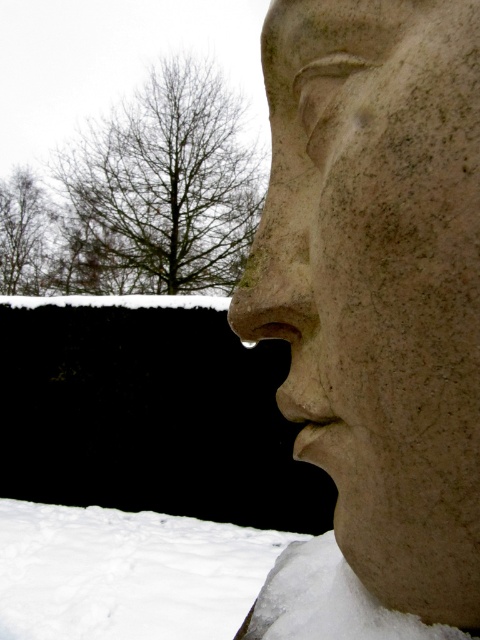
Question: Where is white fluffy snow at lower left located in relation to rough stone nose at center in the image?

Choices:
 (A) above
 (B) below

Answer: (B)

Question: Can you confirm if white fluffy snow at lower left is smaller than brown leafless tree at upper left?

Choices:
 (A) no
 (B) yes

Answer: (B)

Question: Which of the following is the farthest from the observer?

Choices:
 (A) brown leafless tree at upper left
 (B) granite statue at center
 (C) white fluffy snow at lower left
 (D) rough stone nose at center

Answer: (A)

Question: Is the position of granite statue at center more distant than that of rough stone nose at center?

Choices:
 (A) no
 (B) yes

Answer: (A)

Question: Estimate the real-world distances between objects in this image. Which object is closer to the granite statue at center?

Choices:
 (A) rough stone nose at center
 (B) white fluffy snow at lower left
 (C) brown leafless tree at upper left
 (D) bare branches at upper center

Answer: (A)

Question: Which object is the farthest from the granite statue at center?

Choices:
 (A) brown leafless tree at upper left
 (B) white fluffy snow at lower left
 (C) rough stone nose at center

Answer: (A)